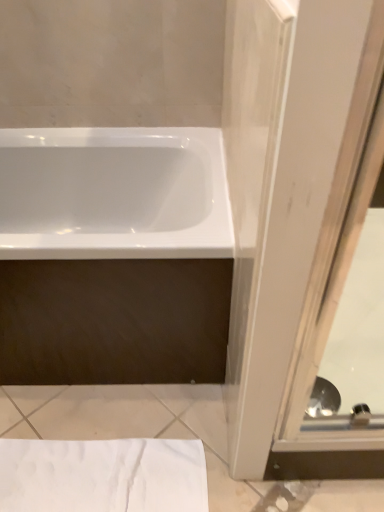
Question: Can you confirm if white textured towel at lower left is smaller than clear glass screen door at right?

Choices:
 (A) no
 (B) yes

Answer: (B)

Question: Is clear glass screen door at right a part of white textured towel at lower left?

Choices:
 (A) yes
 (B) no

Answer: (B)

Question: Is white textured towel at lower left beside clear glass screen door at right?

Choices:
 (A) no
 (B) yes

Answer: (A)

Question: Considering the relative positions of white textured towel at lower left and clear glass screen door at right in the image provided, is white textured towel at lower left to the left of clear glass screen door at right from the viewer's perspective?

Choices:
 (A) yes
 (B) no

Answer: (A)

Question: Does white textured towel at lower left have a greater height compared to clear glass screen door at right?

Choices:
 (A) yes
 (B) no

Answer: (B)

Question: Relative to white glossy bathtub at center, is white textured towel at lower left in front or behind?

Choices:
 (A) behind
 (B) front

Answer: (A)

Question: From a real-world perspective, is white textured towel at lower left positioned above or below white glossy bathtub at center?

Choices:
 (A) above
 (B) below

Answer: (B)

Question: In terms of size, does white textured towel at lower left appear bigger or smaller than white glossy bathtub at center?

Choices:
 (A) small
 (B) big

Answer: (A)

Question: Visually, is white textured towel at lower left positioned to the left or to the right of white glossy bathtub at center?

Choices:
 (A) right
 (B) left

Answer: (A)

Question: Is white glossy bathtub at center in front of or behind white textured towel at lower left in the image?

Choices:
 (A) behind
 (B) front

Answer: (B)

Question: From a real-world perspective, is white glossy bathtub at center above or below white textured towel at lower left?

Choices:
 (A) below
 (B) above

Answer: (B)

Question: Is white glossy bathtub at center wider or thinner than white textured towel at lower left?

Choices:
 (A) thin
 (B) wide

Answer: (B)

Question: Is white glossy bathtub at center bigger or smaller than white textured towel at lower left?

Choices:
 (A) big
 (B) small

Answer: (A)

Question: From a real-world perspective, is white textured towel at lower left physically located above or below clear glass screen door at right?

Choices:
 (A) below
 (B) above

Answer: (A)

Question: Is point tap(165, 504) closer or farther from the camera than point tap(246, 467)?

Choices:
 (A) closer
 (B) farther

Answer: (B)